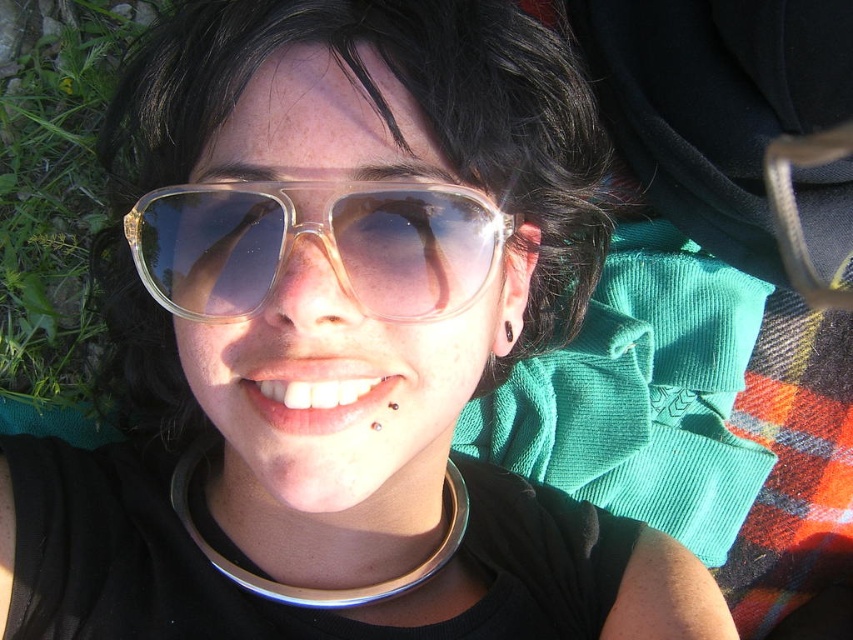
You are a photographer trying to capture the transparent plastic goggles at center and the green grass at lower left in the same frame. Based on their positions, which object should you focus on first to ensure both are in focus?

The transparent plastic goggles at center is located below green grass at lower left, so you should focus on the green grass at lower left first since it is closer to the camera, ensuring both objects remain in focus.

You are trying to place a small toy that is 10 cm wide between the transparent plastic goggles at center and the green grass at lower left. Based on their widths, will the toy fit?

The transparent plastic goggles at center might be wider than green grass at lower left, so the toy might not fit if the space between them is narrower than 10 cm.